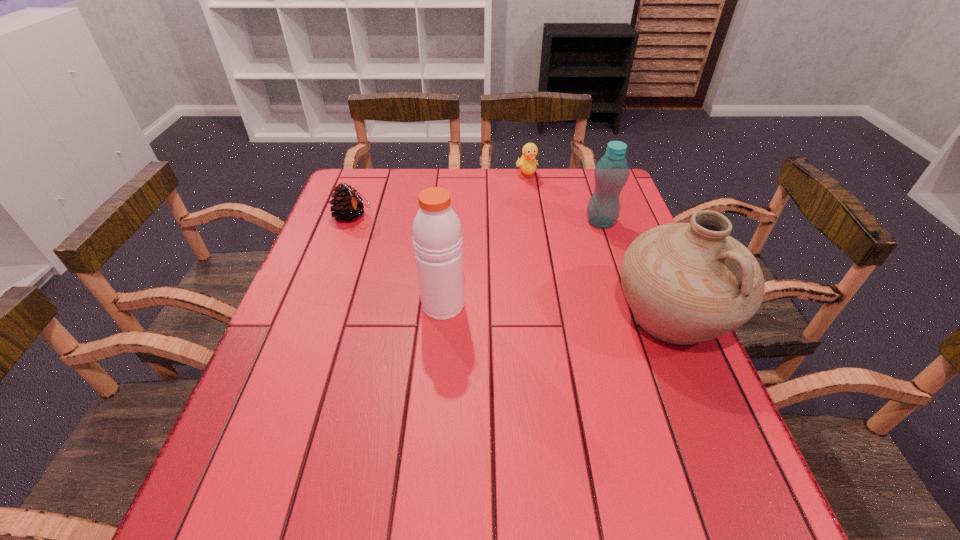
This screenshot has height=540, width=960. Identify the location of the second object from left to right. (437, 233).

You are a GUI agent. You are given a task and a screenshot of the screen. Output one action in this format:
    pyautogui.click(x=<x>, y=<y>)
    Task: Click on the pottery
    The image size is (960, 540).
    Given the screenshot: What is the action you would take?
    pyautogui.click(x=690, y=282)

You are a GUI agent. You are given a task and a screenshot of the screen. Output one action in this format:
    pyautogui.click(x=<x>, y=<y>)
    Task: Click on the water bottle
    
    Given the screenshot: What is the action you would take?
    pyautogui.click(x=611, y=172)

Locate an element on the screen. This screenshot has width=960, height=540. pinecone is located at coordinates (348, 204).

Locate an element on the screen. The height and width of the screenshot is (540, 960). the farthest object is located at coordinates (527, 163).

I want to click on the third object from left to right, so click(x=527, y=163).

This screenshot has width=960, height=540. Find the location of `blank area located on the front of the fourth object from right to left`. blank area located on the front of the fourth object from right to left is located at coordinates (431, 450).

This screenshot has height=540, width=960. I want to click on free spot located on the back of the pottery, so click(x=645, y=253).

The image size is (960, 540). I want to click on vacant space located 0.230m at the front cap of the water bottle, so click(x=561, y=276).

Locate an element on the screen. free space located 0.250m at the front cap of the water bottle is located at coordinates (557, 281).